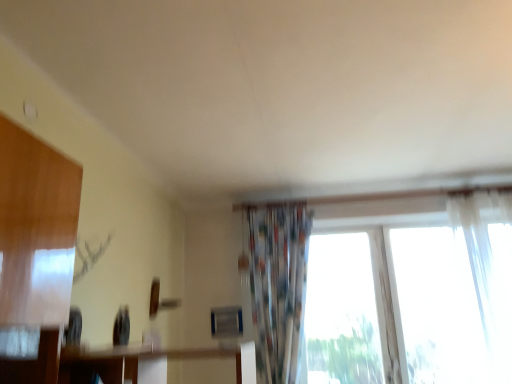
Measure the distance between transparent fabric at right and camera.

They are 2.85 meters apart.

Where is `white sheer curtain at right, placed as the first curtain when sorted from right to left`? The height and width of the screenshot is (384, 512). white sheer curtain at right, placed as the first curtain when sorted from right to left is located at coordinates (483, 266).

The image size is (512, 384). In order to click on transparent fabric at right in this screenshot , I will do `click(438, 308)`.

From the image's perspective, is white sheer curtain at right, which is the second curtain in left-to-right order, above or below transparent fabric at right?

From the image's perspective, white sheer curtain at right, which is the second curtain in left-to-right order, appears above transparent fabric at right.

Is white sheer curtain at right, which is the second curtain in left-to-right order, shorter than transparent fabric at right?

No.

From a real-world perspective, which is physically above, white sheer curtain at right, which is the second curtain in left-to-right order, or transparent fabric at right?

In real-world perspective, white sheer curtain at right, which is the second curtain in left-to-right order, is above.

Considering the sizes of white sheer curtain at right, which is the second curtain in left-to-right order, and transparent fabric at right in the image, is white sheer curtain at right, which is the second curtain in left-to-right order, bigger or smaller than transparent fabric at right?

In the image, white sheer curtain at right, which is the second curtain in left-to-right order, appears to be larger than transparent fabric at right.

Does transparent fabric at right lie in front of printed fabric curtain at center, which appears as the first curtain when viewed from the left?

No, it is behind printed fabric curtain at center, which appears as the first curtain when viewed from the left.

From the image's perspective, between transparent fabric at right and printed fabric curtain at center, which appears as the second curtain when viewed from the right, who is located below?

transparent fabric at right appears lower in the image.

Based on the photo, from their relative heights in the image, would you say transparent fabric at right is taller or shorter than printed fabric curtain at center, which appears as the second curtain when viewed from the right?

Considering their sizes, transparent fabric at right has less height than printed fabric curtain at center, which appears as the second curtain when viewed from the right.

Measure the distance between transparent fabric at right and printed fabric curtain at center, which appears as the first curtain when viewed from the left.

The distance of transparent fabric at right from printed fabric curtain at center, which appears as the first curtain when viewed from the left, is 3.49 feet.

Locate an element on the screen. This screenshot has height=384, width=512. window behind the white sheer curtain at right, placed as the first curtain when sorted from right to left is located at coordinates (438, 308).

From a real-world perspective, is transparent fabric at right beneath white sheer curtain at right, placed as the first curtain when sorted from right to left?

Yes, from a real-world perspective, transparent fabric at right is beneath white sheer curtain at right, placed as the first curtain when sorted from right to left.

Can you see transparent fabric at right touching white sheer curtain at right, placed as the first curtain when sorted from right to left?

There is a gap between transparent fabric at right and white sheer curtain at right, placed as the first curtain when sorted from right to left.

Do you think white sheer curtain at right, which is the second curtain in left-to-right order, is within printed fabric curtain at center, which appears as the first curtain when viewed from the left, or outside of it?

white sheer curtain at right, which is the second curtain in left-to-right order, is not enclosed by printed fabric curtain at center, which appears as the first curtain when viewed from the left.

From the image's perspective, is white sheer curtain at right, which is the second curtain in left-to-right order, positioned above or below printed fabric curtain at center, which appears as the second curtain when viewed from the right?

Based on their image positions, white sheer curtain at right, which is the second curtain in left-to-right order, is located above printed fabric curtain at center, which appears as the second curtain when viewed from the right.

Does white sheer curtain at right, which is the second curtain in left-to-right order, have a greater width compared to printed fabric curtain at center, which appears as the first curtain when viewed from the left?

In fact, white sheer curtain at right, which is the second curtain in left-to-right order, might be narrower than printed fabric curtain at center, which appears as the first curtain when viewed from the left.

From the picture: Would you say white sheer curtain at right, placed as the first curtain when sorted from right to left, is a long distance from printed fabric curtain at center, which appears as the second curtain when viewed from the right?

That's right, there is a large distance between white sheer curtain at right, placed as the first curtain when sorted from right to left, and printed fabric curtain at center, which appears as the second curtain when viewed from the right.

From a real-world perspective, which object rests below the other?

In real-world perspective, white sheer curtain at right, which is the second curtain in left-to-right order, is lower.

Is printed fabric curtain at center, which appears as the second curtain when viewed from the right, to the left or to the right of white sheer curtain at right, which is the second curtain in left-to-right order, in the image?

In the image, printed fabric curtain at center, which appears as the second curtain when viewed from the right, appears on the left side of white sheer curtain at right, which is the second curtain in left-to-right order.

This screenshot has height=384, width=512. Identify the location of curtain that appears above the white sheer curtain at right, which is the second curtain in left-to-right order (from a real-world perspective). (278, 286).

Between printed fabric curtain at center, which appears as the first curtain when viewed from the left, and white sheer curtain at right, which is the second curtain in left-to-right order, which one is positioned behind?

printed fabric curtain at center, which appears as the first curtain when viewed from the left.

Is printed fabric curtain at center, which appears as the first curtain when viewed from the left, inside or outside of transparent fabric at right?

printed fabric curtain at center, which appears as the first curtain when viewed from the left, lies outside transparent fabric at right.

Which is nearer, (287, 266) or (406, 276)?

The point (287, 266) is closer.

What's the angular difference between printed fabric curtain at center, which appears as the second curtain when viewed from the right, and transparent fabric at right's facing directions?

The facing directions of printed fabric curtain at center, which appears as the second curtain when viewed from the right, and transparent fabric at right are 1.27 degrees apart.

Which of these two, printed fabric curtain at center, which appears as the second curtain when viewed from the right, or transparent fabric at right, stands shorter?

transparent fabric at right.

I want to click on curtain that appears on the right of transparent fabric at right, so click(483, 266).

This screenshot has width=512, height=384. I want to click on the 1st curtain in front of the transparent fabric at right, counting from the anchor's position, so click(x=278, y=286).

Based on their spatial positions, is white sheer curtain at right, placed as the first curtain when sorted from right to left, or printed fabric curtain at center, which appears as the first curtain when viewed from the left, closer to transparent fabric at right?

The object closer to transparent fabric at right is white sheer curtain at right, placed as the first curtain when sorted from right to left.

Which object lies further to the anchor point transparent fabric at right, printed fabric curtain at center, which appears as the second curtain when viewed from the right, or white sheer curtain at right, placed as the first curtain when sorted from right to left?

The object further to transparent fabric at right is printed fabric curtain at center, which appears as the second curtain when viewed from the right.

Estimate the real-world distances between objects in this image. Which object is further from white sheer curtain at right, placed as the first curtain when sorted from right to left, transparent fabric at right or printed fabric curtain at center, which appears as the second curtain when viewed from the right?

printed fabric curtain at center, which appears as the second curtain when viewed from the right, is positioned further to the anchor white sheer curtain at right, placed as the first curtain when sorted from right to left.

When comparing their distances from printed fabric curtain at center, which appears as the first curtain when viewed from the left, does transparent fabric at right or white sheer curtain at right, placed as the first curtain when sorted from right to left, seem further?

Among the two, white sheer curtain at right, placed as the first curtain when sorted from right to left, is located further to printed fabric curtain at center, which appears as the first curtain when viewed from the left.

Looking at the image, which one is located closer to printed fabric curtain at center, which appears as the first curtain when viewed from the left, white sheer curtain at right, placed as the first curtain when sorted from right to left, or transparent fabric at right?

The object closer to printed fabric curtain at center, which appears as the first curtain when viewed from the left, is transparent fabric at right.

Based on their spatial positions, is printed fabric curtain at center, which appears as the first curtain when viewed from the left, or transparent fabric at right closer to white sheer curtain at right, which is the second curtain in left-to-right order?

transparent fabric at right.

Find the location of a particular element. window situated between printed fabric curtain at center, which appears as the second curtain when viewed from the right, and white sheer curtain at right, which is the second curtain in left-to-right order, from left to right is located at coordinates (438, 308).